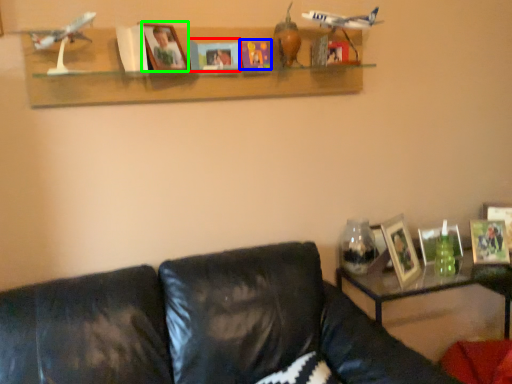
Question: Which is farther away from paperback book (highlighted by a red box)? paperback book (highlighted by a blue box) or picture frame (highlighted by a green box)?

Choices:
 (A) paperback book
 (B) picture frame

Answer: (B)